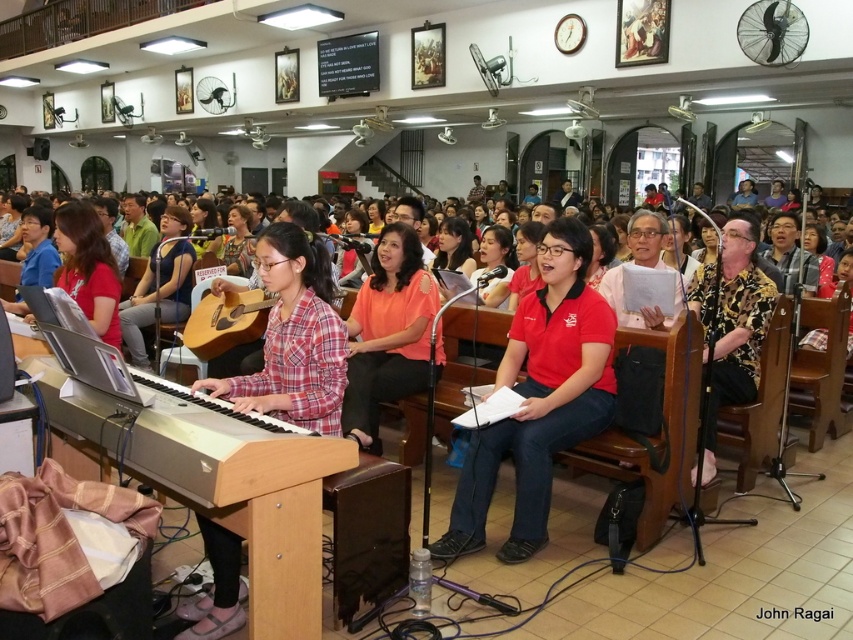
You are organizing a photo shoot and need to ensure that all items in the scene are properly framed. Given the plaid fabric shirt at center and the plaid fabric guitar at center, which item should you focus on to ensure it fits within a smaller frame?

The plaid fabric shirt at center should be focused on because it occupies less space than the plaid fabric guitar at center, making it easier to fit within a smaller frame.

You are standing in the middle of the room and want to move towards the two points marked in the scene. Which point, point (314, 259) or point (405, 358), is closer to you?

Point (314, 259) is closer to the viewer than point (405, 358), so you should move toward that one first.